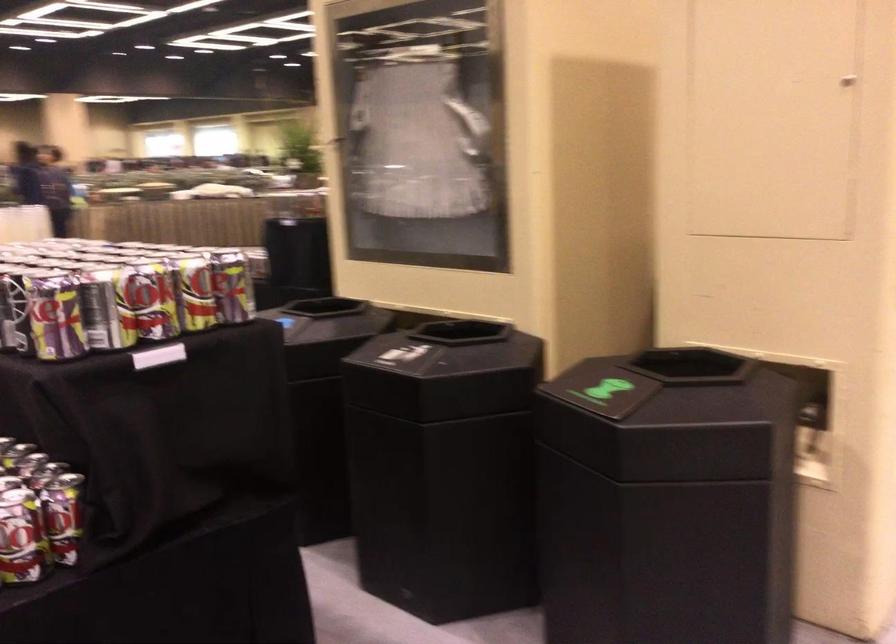
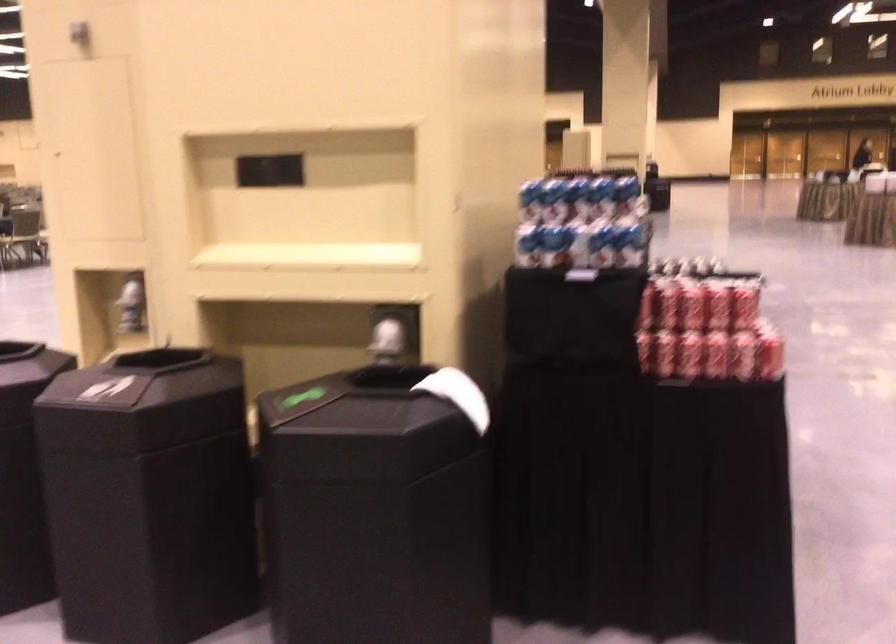
Question: I am providing you with two images of the same scene from different viewpoints. After the viewpoint changes to image2, which objects are now occluded?

Choices:
 (A) red soda can
 (B) beverage can
 (C) white paper towel roll
 (D) white paper towel

Answer: (B)